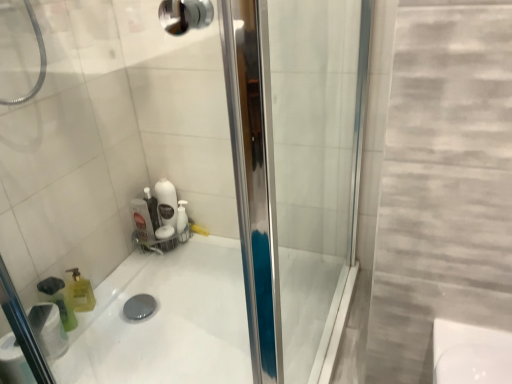
Locate an element on the screen. The image size is (512, 384). white matte toilet paper at lower left is located at coordinates (49, 330).

Find the location of `white glossy bath at center`. white glossy bath at center is located at coordinates (166, 321).

Is white matte toilet paper at lower left further to the viewer compared to translucent green bottle at lower left?

No, white matte toilet paper at lower left is closer to the viewer.

Is white matte toilet paper at lower left at the right side of translucent green bottle at lower left?

Incorrect, white matte toilet paper at lower left is not on the right side of translucent green bottle at lower left.

From the image's perspective, which object appears higher, white matte toilet paper at lower left or translucent green bottle at lower left?

translucent green bottle at lower left appears higher in the image.

Is white matte toilet paper at lower left not near translucent green bottle at lower left?

No, white matte toilet paper at lower left is not far away from translucent green bottle at lower left.

Visually, is translucent green bottle at lower left positioned to the left or to the right of white matte toilet paper at lower left?

In the image, translucent green bottle at lower left appears on the right side of white matte toilet paper at lower left.

How far apart are translucent green bottle at lower left and white matte toilet paper at lower left?

translucent green bottle at lower left is 4.25 inches from white matte toilet paper at lower left.

Image resolution: width=512 pixels, height=384 pixels. I want to click on toilet paper that appears in front of the translucent green bottle at lower left, so click(49, 330).

Can you confirm if translucent green bottle at lower left is wider than white matte toilet paper at lower left?

Incorrect, the width of translucent green bottle at lower left does not surpass that of white matte toilet paper at lower left.

Is white glossy bath at center bigger or smaller than translucent green bottle at lower left?

white glossy bath at center is bigger than translucent green bottle at lower left.

Is white glossy bath at center outside of translucent green bottle at lower left?

Yes, white glossy bath at center is located beyond the bounds of translucent green bottle at lower left.

This screenshot has width=512, height=384. Find the location of `bath that is under the translucent green bottle at lower left (from a real-world perspective)`. bath that is under the translucent green bottle at lower left (from a real-world perspective) is located at coordinates (166, 321).

From the image's perspective, is white glossy bath at center below translucent green bottle at lower left?

Yes.

Considering the positions of point (51, 277) and point (321, 358), is point (51, 277) closer or farther from the camera than point (321, 358)?

Clearly, point (51, 277) is more distant from the camera than point (321, 358).

Considering the relative positions of translucent green bottle at lower left and white glossy bath at center in the image provided, is translucent green bottle at lower left to the left or to the right of white glossy bath at center?

From the image, it's evident that translucent green bottle at lower left is to the left of white glossy bath at center.

Based on the photo, from a real-world perspective, which is physically below, translucent green bottle at lower left or white glossy bath at center?

white glossy bath at center.

Based on the photo, which is in front, translucent green bottle at lower left or white glossy bath at center?

white glossy bath at center is more forward.

Between white glossy bath at center and white matte toilet paper at lower left, which one has more height?

white matte toilet paper at lower left is taller.

Considering the positions of objects white glossy bath at center and white matte toilet paper at lower left in the image provided, who is behind, white glossy bath at center or white matte toilet paper at lower left?

white matte toilet paper at lower left is further from the camera.

Is point (230, 348) positioned before point (37, 329)?

No.

Is white matte toilet paper at lower left at the right side of white glossy bath at center?

No.

From a real-world perspective, is white matte toilet paper at lower left located beneath white glossy bath at center?

No.

Does white matte toilet paper at lower left have a lesser height compared to white glossy bath at center?

Incorrect, the height of white matte toilet paper at lower left does not fall short of that of white glossy bath at center.

You are a GUI agent. You are given a task and a screenshot of the screen. Output one action in this format:
    pyautogui.click(x=<x>, y=<y>)
    Task: Click on the toilet paper on the left side of translucent green bottle at lower left
    This screenshot has width=512, height=384.
    Given the screenshot: What is the action you would take?
    point(49,330)

Identify the location of cleaning product on the right of white matte toilet paper at lower left. pos(58,300).

Looking at the image, which one is located further to white matte toilet paper at lower left, translucent green bottle at lower left or white glossy bath at center?

white glossy bath at center is further to white matte toilet paper at lower left.

Estimate the real-world distances between objects in this image. Which object is closer to white matte toilet paper at lower left, white glossy bath at center or translucent green bottle at lower left?

translucent green bottle at lower left lies closer to white matte toilet paper at lower left than the other object.

Which object lies further to the anchor point white glossy bath at center, translucent green bottle at lower left or white matte toilet paper at lower left?

translucent green bottle at lower left.

Looking at the image, which one is located further to translucent green bottle at lower left, white glossy bath at center or white matte toilet paper at lower left?

The object further to translucent green bottle at lower left is white glossy bath at center.

Which object lies nearer to the anchor point translucent green bottle at lower left, white matte toilet paper at lower left or white glossy bath at center?

Based on the image, white matte toilet paper at lower left appears to be nearer to translucent green bottle at lower left.

When comparing their distances from white glossy bath at center, does white matte toilet paper at lower left or translucent green bottle at lower left seem closer?

white matte toilet paper at lower left.

In order to click on cleaning product between white matte toilet paper at lower left and white glossy bath at center in the horizontal direction in this screenshot , I will do `click(58, 300)`.